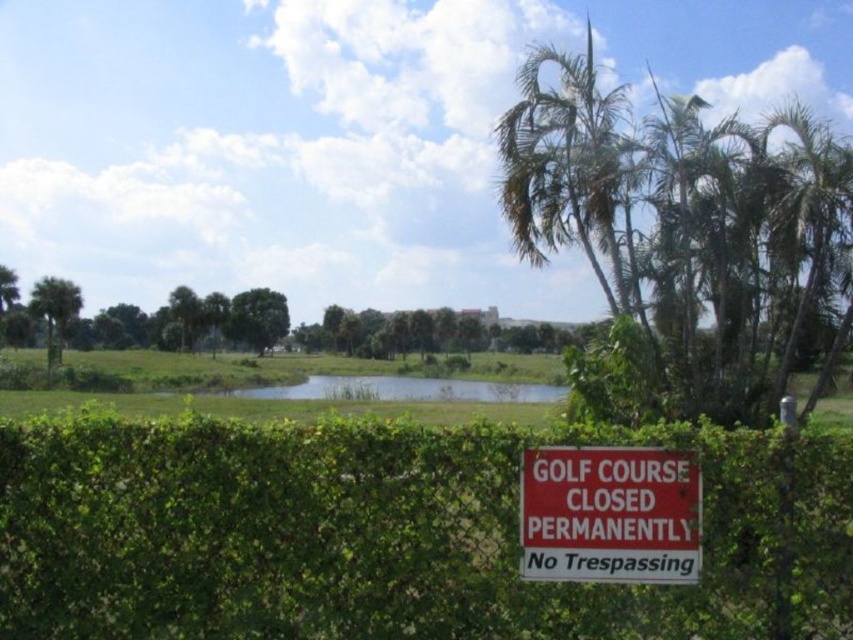
You are standing at the center of the image and want to walk towards the green leafy hedge at lower center. In which direction should you move?

The green leafy hedge at lower center is located at point (389, 534), so you should move downward and to the right to reach it.

You are a landscape architect designing a new garden and want to plant both the green leafy tree at center and the green leafy palm tree at left. Based on their sizes, which one should you place closer to the garden entrance to ensure it doesn

The green leafy tree at center is larger than the green leafy palm tree at left, so you should place the green leafy palm tree at left closer to the garden entrance to ensure it doesn

You are a gardener who needs to trim both the green leafy hedge at lower center and the green leafy tree at center. Based on their positions, which one should you tackle first if you want to work from the bottom up?

The green leafy hedge at lower center is positioned under the green leafy tree at center, so you should trim the green leafy hedge at lower center first to avoid branches from the tree above obstructing your work.